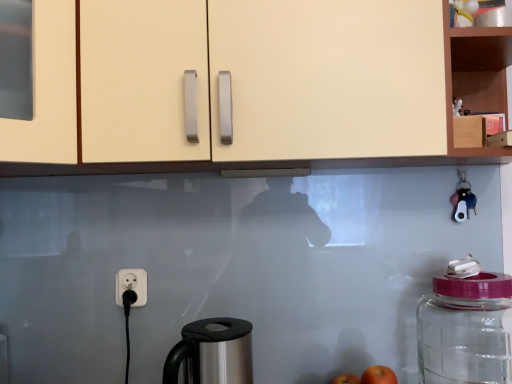
Question: Considering the relative positions of transparent glass jar at right and matte cream cabinet at upper center, which appears as the 1th cabinetry when viewed from the left, in the image provided, is transparent glass jar at right to the right of matte cream cabinet at upper center, which appears as the 1th cabinetry when viewed from the left, from the viewer's perspective?

Choices:
 (A) no
 (B) yes

Answer: (B)

Question: Is transparent glass jar at right smaller than matte cream cabinet at upper center, which appears as the 1th cabinetry when viewed from the left?

Choices:
 (A) yes
 (B) no

Answer: (A)

Question: Considering the relative sizes of transparent glass jar at right and matte cream cabinet at upper center, which appears as the 1th cabinetry when viewed from the left, in the image provided, is transparent glass jar at right thinner than matte cream cabinet at upper center, which appears as the 1th cabinetry when viewed from the left,?

Choices:
 (A) yes
 (B) no

Answer: (A)

Question: Is matte cream cabinet at upper center, the second cabinetry from the right, at the back of transparent glass jar at right?

Choices:
 (A) yes
 (B) no

Answer: (B)

Question: From the image's perspective, is transparent glass jar at right above matte cream cabinet at upper center, which appears as the 1th cabinetry when viewed from the left?

Choices:
 (A) yes
 (B) no

Answer: (B)

Question: Would you say stainless steel coffee maker at lower center is inside or outside red matte apple at lower right, the first apple from the back?

Choices:
 (A) inside
 (B) outside

Answer: (B)

Question: Considering their positions, is stainless steel coffee maker at lower center located in front of or behind red matte apple at lower right, acting as the 2th apple starting from the front?

Choices:
 (A) front
 (B) behind

Answer: (A)

Question: Visually, is stainless steel coffee maker at lower center positioned to the left or to the right of red matte apple at lower right, acting as the 2th apple starting from the front?

Choices:
 (A) left
 (B) right

Answer: (A)

Question: From the image's perspective, is stainless steel coffee maker at lower center positioned above or below red matte apple at lower right, which is counted as the 2th apple, starting from the top?

Choices:
 (A) above
 (B) below

Answer: (A)

Question: From a real-world perspective, relative to stainless steel coffee maker at lower center, is transparent glass jar at right vertically above or below?

Choices:
 (A) above
 (B) below

Answer: (A)

Question: Looking at their shapes, would you say transparent glass jar at right is wider or thinner than stainless steel coffee maker at lower center?

Choices:
 (A) wide
 (B) thin

Answer: (A)

Question: In terms of height, does transparent glass jar at right look taller or shorter compared to stainless steel coffee maker at lower center?

Choices:
 (A) tall
 (B) short

Answer: (A)

Question: In terms of size, does transparent glass jar at right appear bigger or smaller than stainless steel coffee maker at lower center?

Choices:
 (A) small
 (B) big

Answer: (B)

Question: Considering the positions of wooden cabinet at upper right, acting as the 2th cabinetry starting from the left, and transparent glass jar at right in the image, is wooden cabinet at upper right, acting as the 2th cabinetry starting from the left, bigger or smaller than transparent glass jar at right?

Choices:
 (A) big
 (B) small

Answer: (A)

Question: From a real-world perspective, is wooden cabinet at upper right, positioned as the first cabinetry in right-to-left order, above or below transparent glass jar at right?

Choices:
 (A) below
 (B) above

Answer: (B)